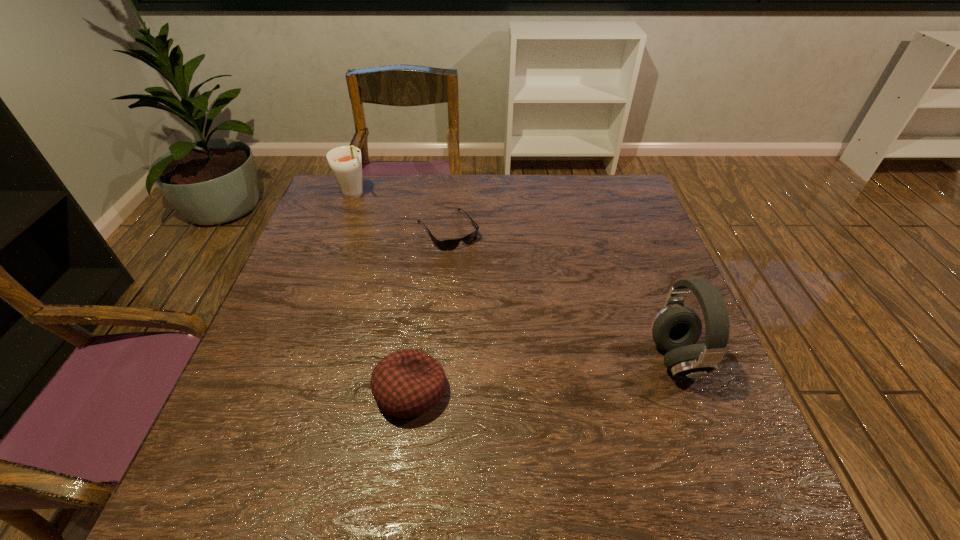
Where is `free point between the shortest object and the leftmost object`? The height and width of the screenshot is (540, 960). free point between the shortest object and the leftmost object is located at coordinates (401, 212).

This screenshot has width=960, height=540. In order to click on free space between the third nearest object and the third tallest object in this screenshot , I will do `click(429, 310)`.

Find the location of a particular element. The height and width of the screenshot is (540, 960). unoccupied area between the leftmost object and the second shortest object is located at coordinates (383, 293).

Where is `vacant space that's between the beanbag and the rightmost object`? The height and width of the screenshot is (540, 960). vacant space that's between the beanbag and the rightmost object is located at coordinates (543, 375).

I want to click on free spot between the farthest object and the third nearest object, so click(x=401, y=212).

Select which object appears as the second closest to the second shortest object. Please provide its 2D coordinates. Your answer should be formatted as a tuple, i.e. [(x, y)], where the tuple contains the x and y coordinates of a point satisfying the conditions above.

[(675, 329)]

Locate which object ranks in proximity to the farthest object. Please provide its 2D coordinates. Your answer should be formatted as a tuple, i.e. [(x, y)], where the tuple contains the x and y coordinates of a point satisfying the conditions above.

[(445, 245)]

This screenshot has width=960, height=540. Identify the location of vacant region that satisfies the following two spatial constraints: 1. on the front side of the leftmost object; 2. on the left side of the shortest object. (343, 230).

You are a GUI agent. You are given a task and a screenshot of the screen. Output one action in this format:
    pyautogui.click(x=<x>, y=<y>)
    Task: Click on the vacant space that satisfies the following two spatial constraints: 1. on the front side of the second farthest object; 2. on the ear cups of the rightmost object
    The image size is (960, 540).
    Given the screenshot: What is the action you would take?
    pyautogui.click(x=437, y=359)